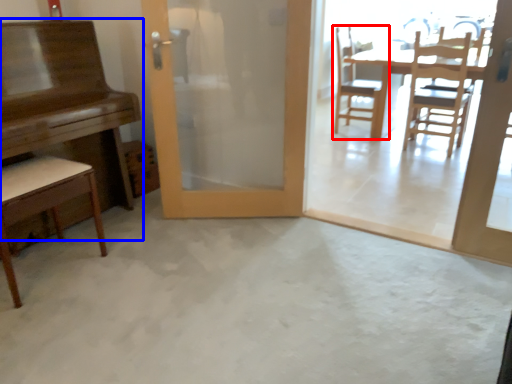
Question: Among these objects, which one is nearest to the camera, chair (highlighted by a red box) or table (highlighted by a blue box)?

Choices:
 (A) chair
 (B) table

Answer: (B)